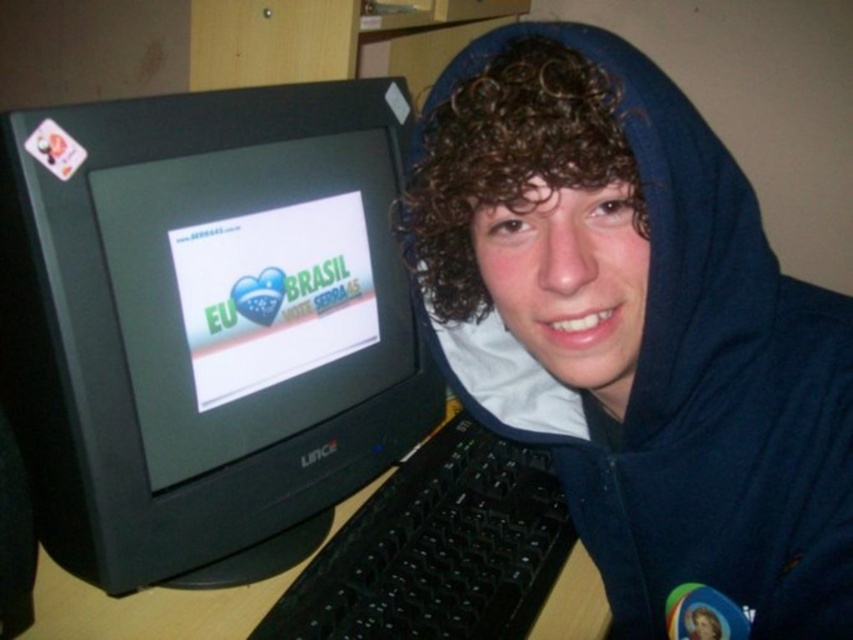
You are setting up a new desk arrangement and want to place a decorative plant between the black plastic monitor at left and the blue fleece hoodie at center. Considering their sizes, which object should the plant be closer to?

The black plastic monitor at left has a larger width than the blue fleece hoodie at center, so the plant should be placed closer to the blue fleece hoodie at center to balance the space between them.

You are a photographer trying to capture a closeup of a specific point in the scene. You have two points to choose from, point (x=483, y=76) and point (x=39, y=577). Which point should you focus on to get the closest possible shot?

Point (x=483, y=76) is closer to the camera than point (x=39, y=577), so focusing on point (x=483, y=76) will allow you to capture the closest possible shot.

You have a small toy car that is 4 inches long. You want to place it between the black plastic monitor at left and the wooden at left. Will it fit without touching either object?

The black plastic monitor at left and wooden at left are 8.03 inches apart. Since the toy car is 4 inches long, it will fit between them without touching either object as there is enough space.